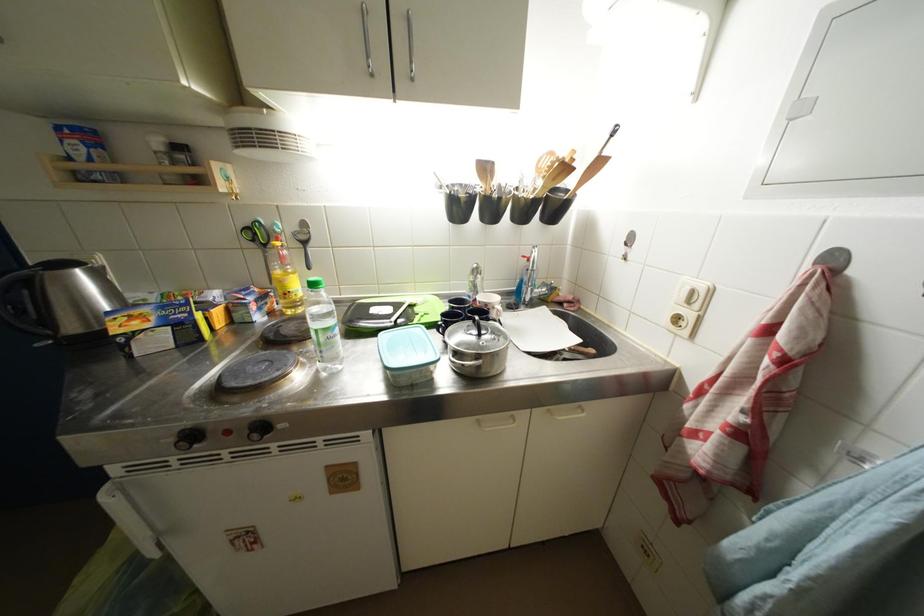
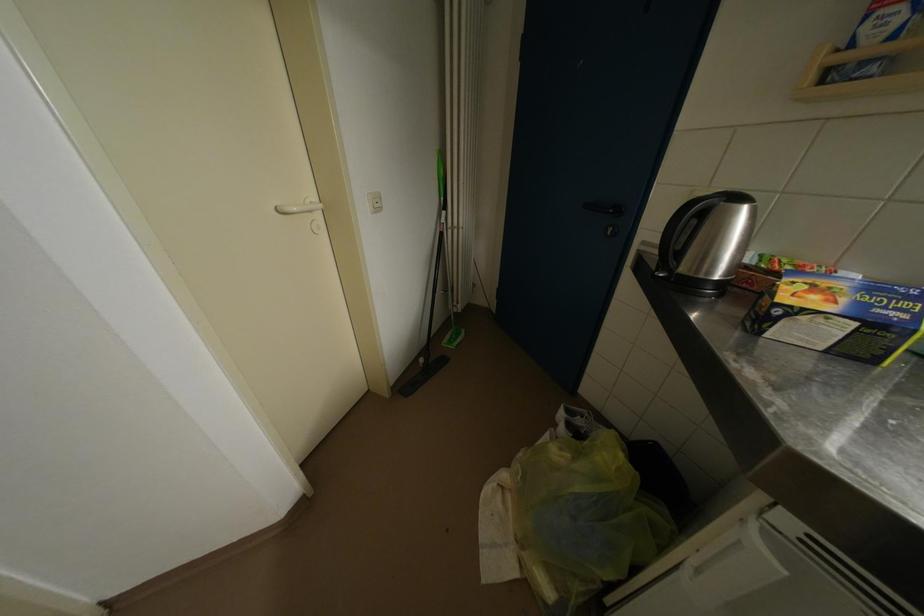
How did the camera likely rotate?

The camera rotated toward left-down.